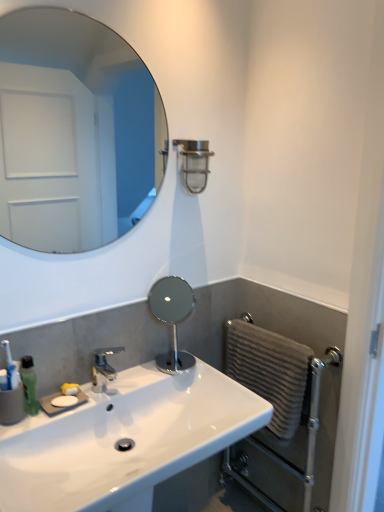
The width and height of the screenshot is (384, 512). Find the location of `white glossy sink at lower left`. white glossy sink at lower left is located at coordinates (122, 438).

You are a GUI agent. You are given a task and a screenshot of the screen. Output one action in this format:
    pyautogui.click(x=<x>, y=<y>)
    Task: Click on the polished silver mirror at center, positioned as the first mirror in bottom-to-top order
    This screenshot has width=384, height=512.
    Given the screenshot: What is the action you would take?
    pyautogui.click(x=172, y=318)

You are a GUI agent. You are given a task and a screenshot of the screen. Output one action in this format:
    pyautogui.click(x=<x>, y=<y>)
    Task: Click on the satin nickel shower at upper center
    This screenshot has height=512, width=384.
    Given the screenshot: What is the action you would take?
    pyautogui.click(x=194, y=163)

Find the location of `silver metallic faucet at center`. silver metallic faucet at center is located at coordinates (103, 368).

Which object is positioned more to the left, white glossy sink at lower left or gray textured towel at right?

From the viewer's perspective, white glossy sink at lower left appears more on the left side.

Is white glossy sink at lower left oriented away from gray textured towel at right?

No.

From a real-world perspective, is white glossy sink at lower left beneath gray textured towel at right?

No, from a real-world perspective, white glossy sink at lower left is not below gray textured towel at right.

Which object is thinner, polished silver mirror at center, positioned as the first mirror in bottom-to-top order, or gray textured towel at right?

gray textured towel at right.

Can you confirm if polished silver mirror at center, positioned as the first mirror in bottom-to-top order, is shorter than gray textured towel at right?

Correct, polished silver mirror at center, positioned as the first mirror in bottom-to-top order, is not as tall as gray textured towel at right.

Consider the image. From a real-world perspective, is polished silver mirror at center, acting as the 2th mirror starting from the top, under gray textured towel at right?

Incorrect, from a real-world perspective, polished silver mirror at center, acting as the 2th mirror starting from the top, is higher than gray textured towel at right.

How many degrees apart are the facing directions of polished silver mirror at center, positioned as the first mirror in bottom-to-top order, and gray textured towel at right?

The angle between the facing direction of polished silver mirror at center, positioned as the first mirror in bottom-to-top order, and the facing direction of gray textured towel at right is 90.4 degrees.

Is silver metallic faucet at center looking in the opposite direction of green translucent soap dispenser at lower left?

No, silver metallic faucet at center is not facing the opposite direction of green translucent soap dispenser at lower left.

Which object is positioned more to the left, silver metallic faucet at center or green translucent soap dispenser at lower left?

→ Positioned to the left is green translucent soap dispenser at lower left.

Based on the photo, does silver metallic faucet at center lie behind green translucent soap dispenser at lower left?

Yes, it is.

Does white glossy sink at lower left appear on the left side of white glossy mirror at upper left, arranged as the 1th mirror when viewed from the top?

No, white glossy sink at lower left is not to the left of white glossy mirror at upper left, arranged as the 1th mirror when viewed from the top.

Can you see white glossy sink at lower left touching white glossy mirror at upper left, arranged as the 1th mirror when viewed from the top?

No, white glossy sink at lower left is not beside white glossy mirror at upper left, arranged as the 1th mirror when viewed from the top.

The image size is (384, 512). In order to click on mirror that is the 1st object located behind the white glossy sink at lower left in this screenshot , I will do `click(74, 132)`.

Does green translucent soap dispenser at lower left lie in front of white glossy sink at lower left?

No, green translucent soap dispenser at lower left is behind white glossy sink at lower left.

Can you confirm if green translucent soap dispenser at lower left is bigger than white glossy sink at lower left?

No, green translucent soap dispenser at lower left is not bigger than white glossy sink at lower left.

From a real-world perspective, is green translucent soap dispenser at lower left above or below white glossy sink at lower left?

From a real-world perspective, green translucent soap dispenser at lower left is physically above white glossy sink at lower left.

How different are the orientations of gray textured towel at right and polished silver mirror at center, positioned as the first mirror in bottom-to-top order, in degrees?

90.4 degrees separate the facing orientations of gray textured towel at right and polished silver mirror at center, positioned as the first mirror in bottom-to-top order.

Which of these two, gray textured towel at right or polished silver mirror at center, acting as the 2th mirror starting from the top, stands shorter?

polished silver mirror at center, acting as the 2th mirror starting from the top.

From the image's perspective, is gray textured towel at right over polished silver mirror at center, positioned as the first mirror in bottom-to-top order?

No, from the image's perspective, gray textured towel at right is not over polished silver mirror at center, positioned as the first mirror in bottom-to-top order.

Consider the image. Who is smaller, white glossy sink at lower left or green translucent soap dispenser at lower left?

green translucent soap dispenser at lower left.

Is white glossy sink at lower left turned away from green translucent soap dispenser at lower left?

No, green translucent soap dispenser at lower left is not at the back of white glossy sink at lower left.

In the scene shown: Does white glossy sink at lower left have a greater height compared to green translucent soap dispenser at lower left?

No, white glossy sink at lower left is not taller than green translucent soap dispenser at lower left.

Identify the location of sink below the gray textured towel at right (from the image's perspective). The width and height of the screenshot is (384, 512). (122, 438).

From the image's perspective, starting from the gray textured towel at right, which mirror is the 1st one above? Please provide its 2D coordinates.

[(172, 318)]

Which object lies nearer to the anchor point white glossy sink at lower left, white glossy mirror at upper left, marked as the second mirror in a bottom-to-top arrangement, or green translucent soap dispenser at lower left?

Among the two, green translucent soap dispenser at lower left is located nearer to white glossy sink at lower left.

Based on their spatial positions, is silver metallic faucet at center or satin nickel shower at upper center closer to green translucent soap dispenser at lower left?

silver metallic faucet at center is closer to green translucent soap dispenser at lower left.

Based on their spatial positions, is green translucent soap dispenser at lower left or white glossy sink at lower left further from polished silver mirror at center, positioned as the first mirror in bottom-to-top order?

The object further to polished silver mirror at center, positioned as the first mirror in bottom-to-top order, is green translucent soap dispenser at lower left.

From the picture: When comparing their distances from silver metallic faucet at center, does white glossy mirror at upper left, arranged as the 1th mirror when viewed from the top, or green translucent soap dispenser at lower left seem closer?

Based on the image, green translucent soap dispenser at lower left appears to be nearer to silver metallic faucet at center.

Based on their spatial positions, is white glossy mirror at upper left, marked as the second mirror in a bottom-to-top arrangement, or white glossy sink at lower left further from silver metallic faucet at center?

Among the two, white glossy mirror at upper left, marked as the second mirror in a bottom-to-top arrangement, is located further to silver metallic faucet at center.

Which object lies further to the anchor point green translucent soap dispenser at lower left, satin nickel shower at upper center or silver metallic faucet at center?

satin nickel shower at upper center.

Looking at the image, which one is located closer to white glossy sink at lower left, silver metallic faucet at center or polished silver mirror at center, acting as the 2th mirror starting from the top?

silver metallic faucet at center is positioned closer to the anchor white glossy sink at lower left.

Looking at the image, which one is located closer to white glossy sink at lower left, silver metallic faucet at center or satin nickel shower at upper center?

The object closer to white glossy sink at lower left is silver metallic faucet at center.

You are a GUI agent. You are given a task and a screenshot of the screen. Output one action in this format:
    pyautogui.click(x=<x>, y=<y>)
    Task: Click on the shower between white glossy mirror at upper left, arranged as the 1th mirror when viewed from the top, and gray textured towel at right vertically
    The image size is (384, 512).
    Given the screenshot: What is the action you would take?
    pyautogui.click(x=194, y=163)

I want to click on soap dispenser positioned between white glossy sink at lower left and silver metallic faucet at center from near to far, so click(x=29, y=385).

Identify the location of soap dispenser between white glossy mirror at upper left, marked as the second mirror in a bottom-to-top arrangement, and white glossy sink at lower left vertically. The height and width of the screenshot is (512, 384). (29, 385).

The width and height of the screenshot is (384, 512). I want to click on mirror between satin nickel shower at upper center and green translucent soap dispenser at lower left vertically, so click(x=172, y=318).